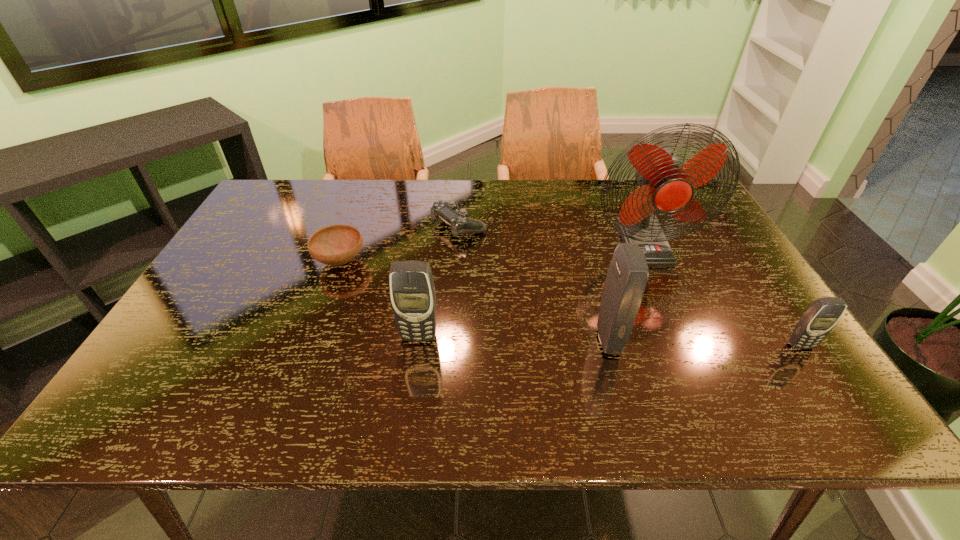
In the image, there is a desktop. Where is `vacant space at the left edge`? This screenshot has height=540, width=960. vacant space at the left edge is located at coordinates (168, 348).

The image size is (960, 540). I want to click on vacant area at the right edge of the desktop, so click(x=698, y=271).

In the image, there is a desktop. Identify the location of free space at the far left corner. The height and width of the screenshot is (540, 960). pyautogui.click(x=287, y=214).

I want to click on empty location between the rightmost object and the fan, so click(722, 295).

Where is `vacant space that is in between the bowl and the second cellular telephone from left to right`? Image resolution: width=960 pixels, height=540 pixels. vacant space that is in between the bowl and the second cellular telephone from left to right is located at coordinates pyautogui.click(x=474, y=301).

Where is `free space between the fan and the control`? free space between the fan and the control is located at coordinates (551, 235).

I want to click on vacant space that is in between the fan and the control, so click(x=551, y=235).

At what (x,y) coordinates should I click in order to perform the action: click on empty space that is in between the leftmost cellular telephone and the second cellular telephone from right to left. Please return your answer as a coordinate pair (x, y). Looking at the image, I should click on (514, 339).

Where is `empty location between the second cellular telephone from left to right and the second shortest cellular telephone`? empty location between the second cellular telephone from left to right and the second shortest cellular telephone is located at coordinates point(514,339).

The image size is (960, 540). Identify the location of blank region between the second cellular telephone from left to right and the leftmost cellular telephone. (514, 339).